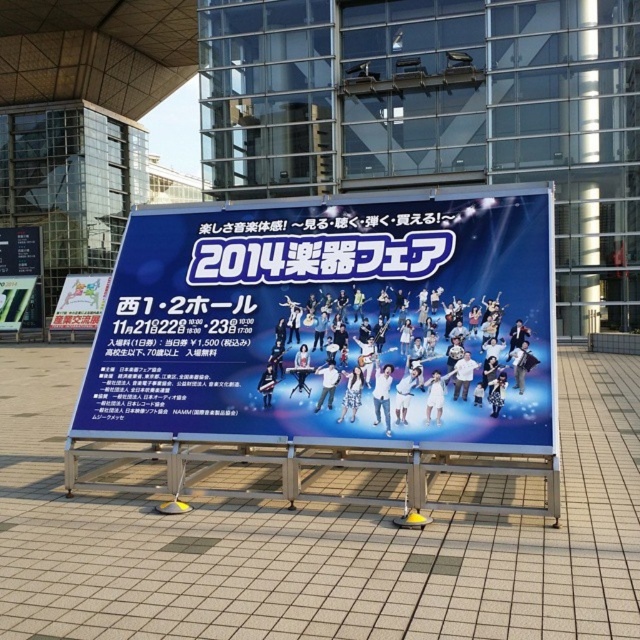
In the scene shown: Is white paper at lower left closer to the viewer compared to metallic silver sign at lower left?

Yes.

Does white paper at lower left have a lesser height compared to metallic silver sign at lower left?

Yes, white paper at lower left is shorter than metallic silver sign at lower left.

Locate an element on the screen. This screenshot has width=640, height=640. white paper at lower left is located at coordinates (81, 301).

Identify the location of white paper at lower left. Image resolution: width=640 pixels, height=640 pixels. (81, 301).

Based on the photo, does blue fabric billboard at center have a greater height compared to white paper at lower left?

Correct, blue fabric billboard at center is much taller as white paper at lower left.

Identify the location of blue fabric billboard at center. (324, 321).

Which is in front, point (534, 422) or point (90, 276)?

Point (534, 422) is more forward.

Locate an element on the screen. Image resolution: width=640 pixels, height=640 pixels. blue fabric billboard at center is located at coordinates (324, 321).

Can you confirm if blue fabric billboard at center is shorter than metallic silver sign at lower left?

Yes, blue fabric billboard at center is shorter than metallic silver sign at lower left.

Can you confirm if blue fabric billboard at center is wider than metallic silver sign at lower left?

Yes.

Between point (544, 445) and point (19, 288), which one is positioned behind?

The point (19, 288) is behind.

Where is `blue fabric billboard at center`? The height and width of the screenshot is (640, 640). blue fabric billboard at center is located at coordinates (x=324, y=321).